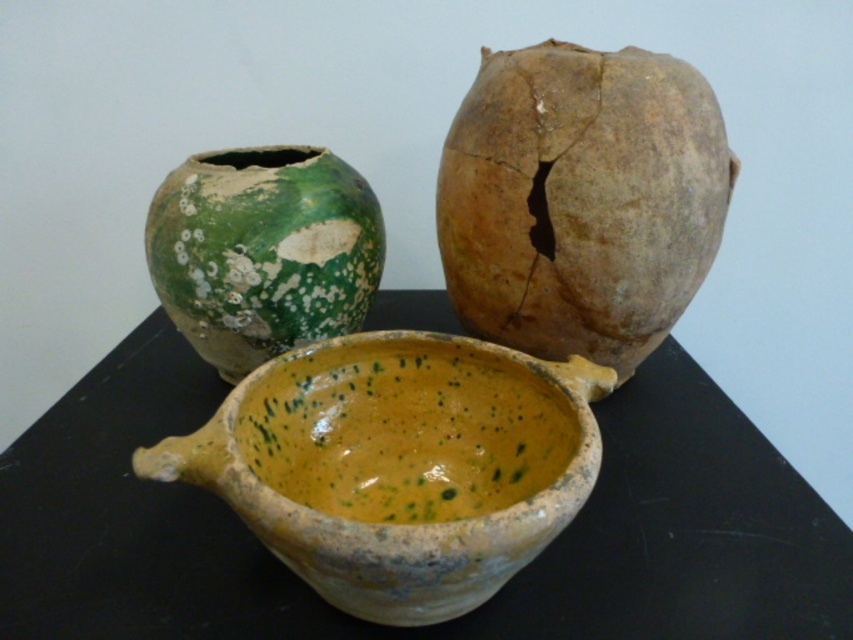
Is speckled clay soup bowl at center below green speckled clay vase at upper left?

Yes, speckled clay soup bowl at center is below green speckled clay vase at upper left.

Between point (527, 461) and point (374, 289), which one is positioned in front?

Point (527, 461) is more forward.

Where is `speckled clay soup bowl at center`? This screenshot has height=640, width=853. speckled clay soup bowl at center is located at coordinates point(399,465).

Who is more distant from viewer, (581, 440) or (663, 285)?

Positioned behind is point (663, 285).

Where is `speckled clay soup bowl at center`? This screenshot has width=853, height=640. speckled clay soup bowl at center is located at coordinates (399, 465).

The height and width of the screenshot is (640, 853). I want to click on speckled clay soup bowl at center, so click(x=399, y=465).

Does yellow speckled clay bowl at center come behind green speckled clay vase at upper left?

No, it is not.

Is point (763, 488) more distant than point (254, 150)?

No, it is in front of (254, 150).

In order to click on yellow speckled clay bowl at center in this screenshot , I will do `click(433, 625)`.